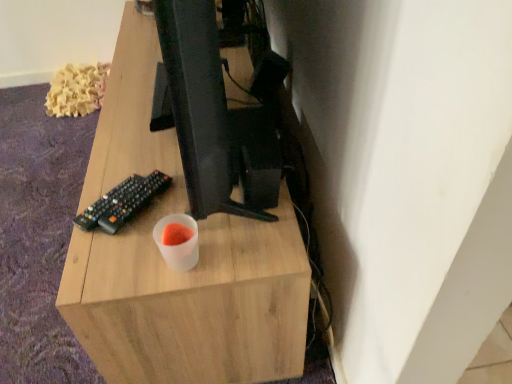
I want to click on light wood desk at center, so click(x=178, y=273).

What do you see at coordinates (178, 273) in the screenshot? I see `light wood desk at center` at bounding box center [178, 273].

Describe the element at coordinates (122, 202) in the screenshot. This screenshot has width=512, height=384. I see `black plastic remote control at lower left` at that location.

Locate an element on the screen. The image size is (512, 384). black plastic remote control at lower left is located at coordinates pos(122,202).

Find the location of `light wood desk at center`. light wood desk at center is located at coordinates (178, 273).

In the scene shown: Can you confirm if black plastic remote control at lower left is positioned to the right of light wood desk at center?

No, black plastic remote control at lower left is not to the right of light wood desk at center.

Is black plastic remote control at lower left positioned behind light wood desk at center?

That is True.

Which is less distant, (138, 195) or (175, 151)?

The point (138, 195) is closer.

From the image's perspective, is black plastic remote control at lower left above light wood desk at center?

No, from the image's perspective, black plastic remote control at lower left is not over light wood desk at center.

From a real-world perspective, between black plastic remote control at lower left and light wood desk at center, who is vertically higher?

black plastic remote control at lower left.

Which object is wider, black plastic remote control at lower left or light wood desk at center?

light wood desk at center.

Is black plastic remote control at lower left taller or shorter than light wood desk at center?

Considering their sizes, black plastic remote control at lower left has less height than light wood desk at center.

Considering the sizes of objects black plastic remote control at lower left and light wood desk at center in the image provided, who is smaller, black plastic remote control at lower left or light wood desk at center?

black plastic remote control at lower left is smaller.

Is black plastic remote control at lower left not within light wood desk at center?

black plastic remote control at lower left lies outside light wood desk at center's area.

Are black plastic remote control at lower left and light wood desk at center located far from each other?

No.

Is black plastic remote control at lower left facing towards light wood desk at center?

No, black plastic remote control at lower left is not turned towards light wood desk at center.

At what (x,y) coordinates should I click in order to perform the action: click on desk above the black plastic remote control at lower left (from the image's perspective). Please return your answer as a coordinate pair (x, y). This screenshot has width=512, height=384. Looking at the image, I should click on (178, 273).

Is light wood desk at center to the left or to the right of black plastic remote control at lower left in the image?

light wood desk at center is to the right of black plastic remote control at lower left.

Which object is further away from the camera taking this photo, light wood desk at center or black plastic remote control at lower left?

black plastic remote control at lower left is more distant.

Based on the photo, which point is more distant from viewer, (208, 344) or (93, 225)?

Point (208, 344)

From the image's perspective, is light wood desk at center beneath black plastic remote control at lower left?

Actually, light wood desk at center appears above black plastic remote control at lower left in the image.

From a real-world perspective, which is physically below, light wood desk at center or black plastic remote control at lower left?

In real-world perspective, light wood desk at center is lower.

Considering the sizes of objects light wood desk at center and black plastic remote control at lower left in the image provided, who is wider, light wood desk at center or black plastic remote control at lower left?

light wood desk at center.

Who is taller, light wood desk at center or black plastic remote control at lower left?

light wood desk at center is taller.

Which of these two, light wood desk at center or black plastic remote control at lower left, is smaller?

black plastic remote control at lower left is smaller.

Is light wood desk at center completely or partially outside of black plastic remote control at lower left?

Yes, light wood desk at center is outside of black plastic remote control at lower left.

Is light wood desk at center not close to black plastic remote control at lower left?

That's not correct — light wood desk at center is a little close to black plastic remote control at lower left.

Does light wood desk at center turn towards black plastic remote control at lower left?

No.

How different are the orientations of light wood desk at center and black plastic remote control at lower left in degrees?

The angular difference between light wood desk at center and black plastic remote control at lower left is 36.4 degrees.

In order to click on computer keyboard on the left side of light wood desk at center in this screenshot , I will do `click(122, 202)`.

Where is `computer keyboard that appears below the light wood desk at center (from the image's perspective)`? Image resolution: width=512 pixels, height=384 pixels. computer keyboard that appears below the light wood desk at center (from the image's perspective) is located at coordinates (122, 202).

Find the location of a particular element. desk lying on the right of black plastic remote control at lower left is located at coordinates (178, 273).